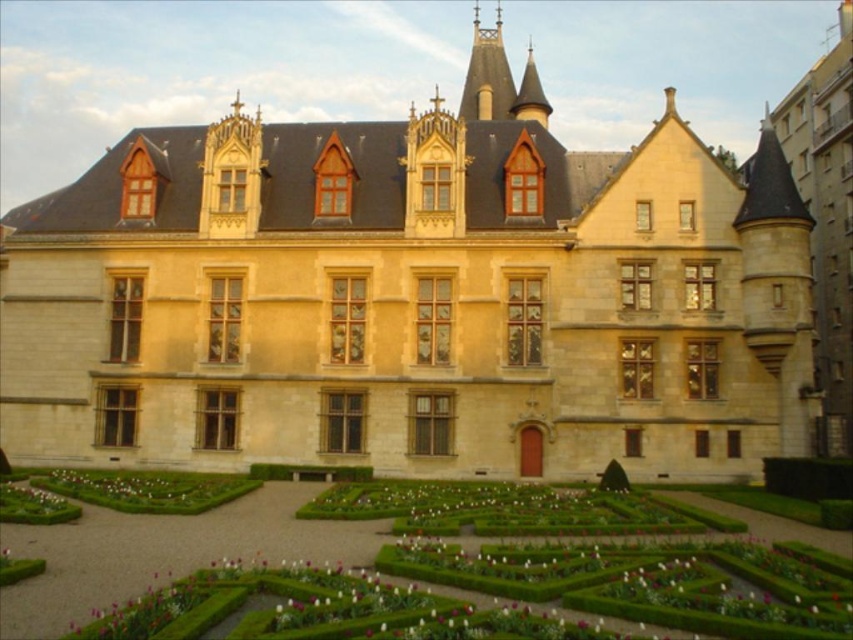
You are standing at the entrance of the grand historic building and see the point marked at coordinates (164, 552). What object is located at that position?

The point at coordinates (164, 552) indicates the green hedge maze at lower center.

You are a gardener standing at the entrance of the green leafy hedge at center. You want to reach the green hedge maze at lower center. Which direction should you walk towards?

The green hedge maze at lower center is to the right of the green leafy hedge at center, so you should walk towards the right to reach it.

You are standing in front of the beige stone palace at center. There is a point marked at coordinates [413,298]. What is the location of this point relative to the beige stone palace at center?

The point at coordinates [413,298] is located on the beige stone palace at center.